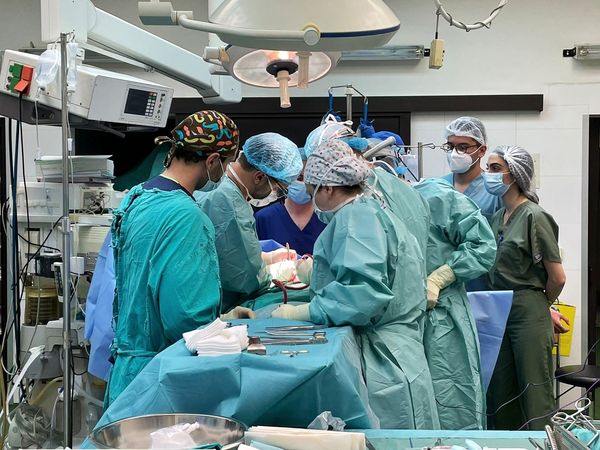
You are a GUI agent. You are given a task and a screenshot of the screen. Output one action in this format:
    pyautogui.click(x=<x>, y=<y>)
    Task: Click on the medical room
    The height and width of the screenshot is (450, 600).
    Given the screenshot: What is the action you would take?
    pyautogui.click(x=334, y=411)